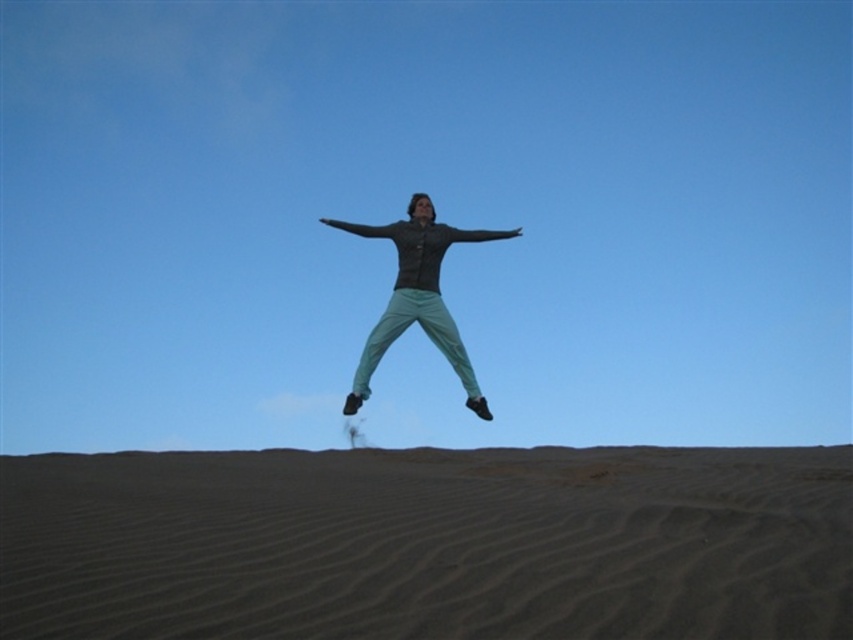
Is dark brown textured sand at lower center closer to camera compared to teal fabric pants at center?

Yes, it is in front of teal fabric pants at center.

Locate an element on the screen. This screenshot has height=640, width=853. dark brown textured sand at lower center is located at coordinates (428, 545).